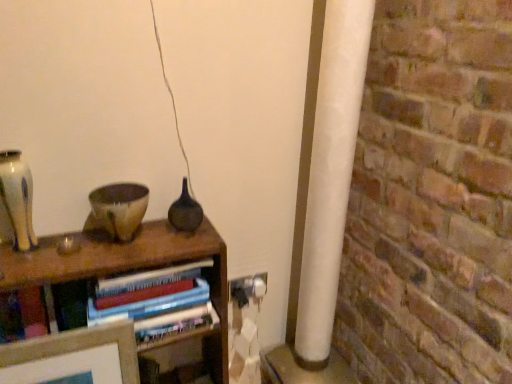
Question: Which direction should I rotate to face matte dark glass vase at center, the 2th glass vase in the front-to-back sequence, — up or down?

Choices:
 (A) up
 (B) down

Answer: (B)

Question: Is matte dark glass vase at center, which is the first glass vase from right to left, facing away from white plastic electric outlet at lower right?

Choices:
 (A) yes
 (B) no

Answer: (B)

Question: Is matte dark glass vase at center, which appears as the 1th glass vase when viewed from the back, behind white plastic electric outlet at lower right?

Choices:
 (A) no
 (B) yes

Answer: (A)

Question: From a real-world perspective, is matte dark glass vase at center, the 2th glass vase in the front-to-back sequence, positioned under white plastic electric outlet at lower right based on gravity?

Choices:
 (A) yes
 (B) no

Answer: (B)

Question: Is matte dark glass vase at center, which is the first glass vase from right to left, beside white plastic electric outlet at lower right?

Choices:
 (A) yes
 (B) no

Answer: (B)

Question: Is matte dark glass vase at center, the 2th glass vase viewed from the left, at the right side of white plastic electric outlet at lower right?

Choices:
 (A) yes
 (B) no

Answer: (B)

Question: Can you confirm if matte dark glass vase at center, the 2th glass vase viewed from the left, is positioned to the left of white plastic electric outlet at lower right?

Choices:
 (A) no
 (B) yes

Answer: (B)

Question: Is speckled ceramic bowl at center wider than matte dark glass vase at center, which is the first glass vase from right to left?

Choices:
 (A) yes
 (B) no

Answer: (A)

Question: From the image's perspective, is speckled ceramic bowl at center under matte dark glass vase at center, which is the first glass vase from right to left?

Choices:
 (A) yes
 (B) no

Answer: (A)

Question: Is the depth of speckled ceramic bowl at center greater than that of matte dark glass vase at center, the 2th glass vase in the front-to-back sequence?

Choices:
 (A) no
 (B) yes

Answer: (A)

Question: Is speckled ceramic bowl at center not inside matte dark glass vase at center, the 2th glass vase viewed from the left?

Choices:
 (A) no
 (B) yes

Answer: (B)

Question: Can you confirm if speckled ceramic bowl at center is positioned to the right of matte dark glass vase at center, the 2th glass vase viewed from the left?

Choices:
 (A) yes
 (B) no

Answer: (B)

Question: Can you confirm if speckled ceramic bowl at center is bigger than matte dark glass vase at center, which appears as the 1th glass vase when viewed from the back?

Choices:
 (A) yes
 (B) no

Answer: (A)

Question: Does matte beige vase at left, the 1th glass vase viewed from the front, come in front of hardcover books at center?

Choices:
 (A) no
 (B) yes

Answer: (A)